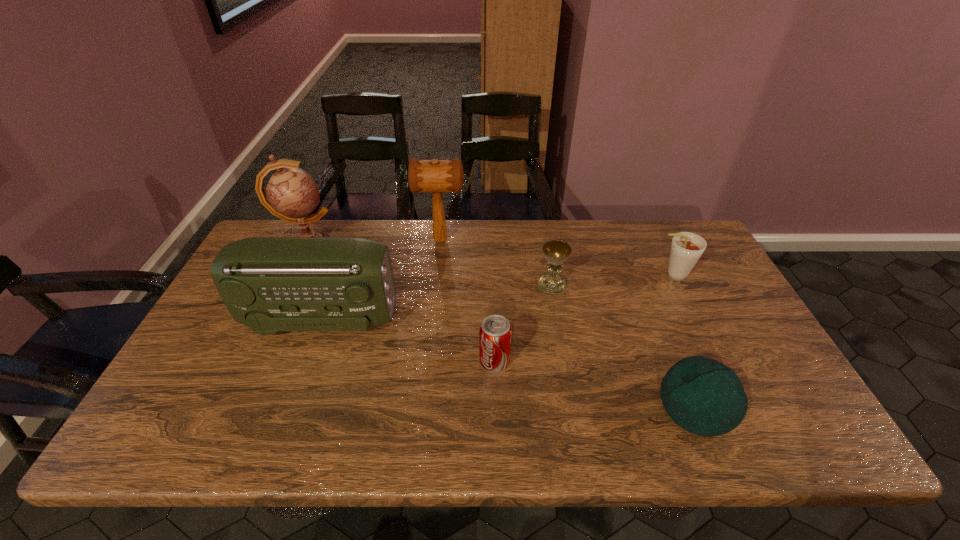
Identify the location of free point between the second nearest object and the beanie. (595, 383).

Identify the location of free spot between the second nearest object and the third nearest object. (408, 341).

The width and height of the screenshot is (960, 540). Find the location of `object that is the fourth nearest to the third tallest object`. object that is the fourth nearest to the third tallest object is located at coordinates (556, 252).

Image resolution: width=960 pixels, height=540 pixels. What are the coordinates of `the fifth closest object relative to the globe` in the screenshot? It's located at (703, 396).

Identify the location of vacant space that satisfies the following two spatial constraints: 1. on the strike surface of the mallet; 2. on the right side of the second nearest object. (428, 361).

Locate an element on the screen. This screenshot has height=540, width=960. vacant space that satisfies the following two spatial constraints: 1. on the front-facing side of the globe; 2. on the left side of the nearest object is located at coordinates (234, 406).

The height and width of the screenshot is (540, 960). Find the location of `vacant region that satisfies the following two spatial constraints: 1. on the front-facing side of the fifth shortest object; 2. on the right side of the fourth object from right to left`. vacant region that satisfies the following two spatial constraints: 1. on the front-facing side of the fifth shortest object; 2. on the right side of the fourth object from right to left is located at coordinates (306, 361).